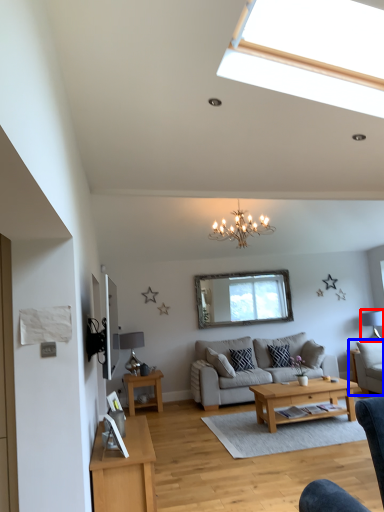
Question: Which point is closer to the camera, lamp (highlighted by a red box) or armchair (highlighted by a blue box)?

Choices:
 (A) lamp
 (B) armchair

Answer: (B)